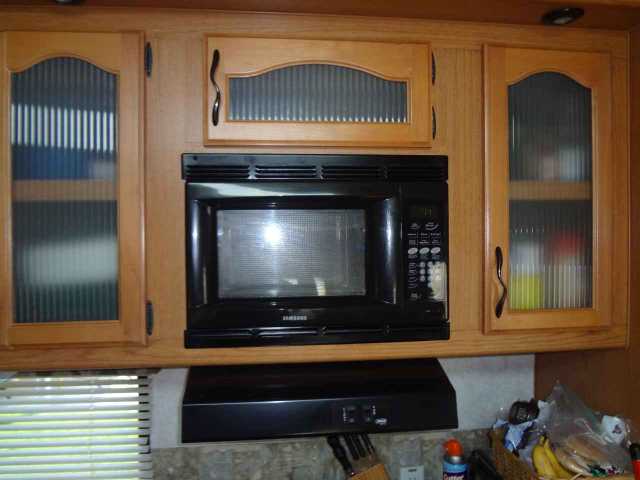
The width and height of the screenshot is (640, 480). I want to click on 1 right cabinet, so click(563, 252).